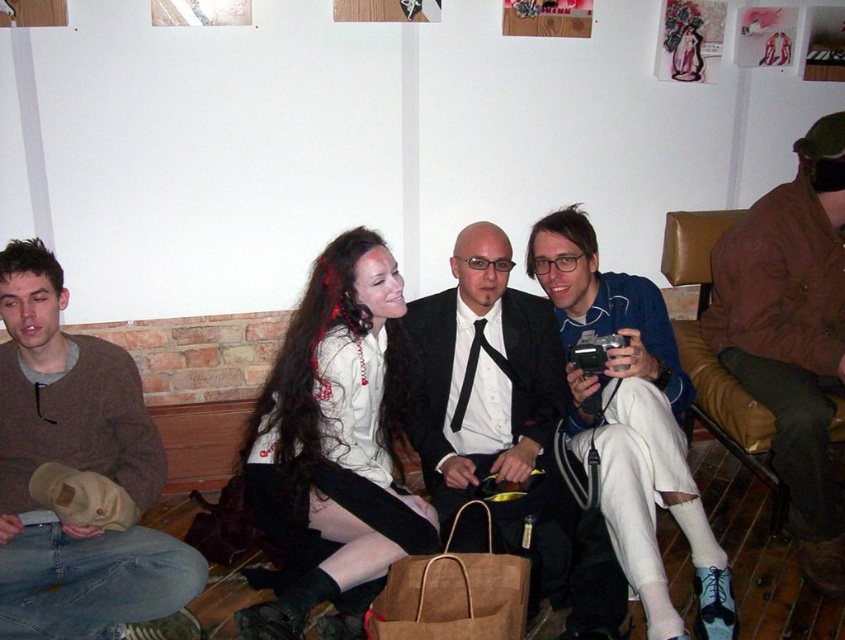
Question: Among these points, which one is farthest from the camera?

Choices:
 (A) (628, 339)
 (B) (383, 253)

Answer: (A)

Question: Which object is closer to the camera taking this photo?

Choices:
 (A) brown corduroy jacket at right
 (B) brown sweater at left
 (C) matte black suit at center

Answer: (B)

Question: Is white matte pants at center positioned in front of matte black suit at center?

Choices:
 (A) yes
 (B) no

Answer: (A)

Question: Does white satin blouse at center appear on the right side of brown corduroy jacket at right?

Choices:
 (A) yes
 (B) no

Answer: (B)

Question: Which of the following is the farthest from the observer?

Choices:
 (A) (101, 369)
 (B) (557, 307)
 (C) (492, 280)

Answer: (B)

Question: Can you confirm if white matte pants at center is positioned below matte black suit at center?

Choices:
 (A) no
 (B) yes

Answer: (A)